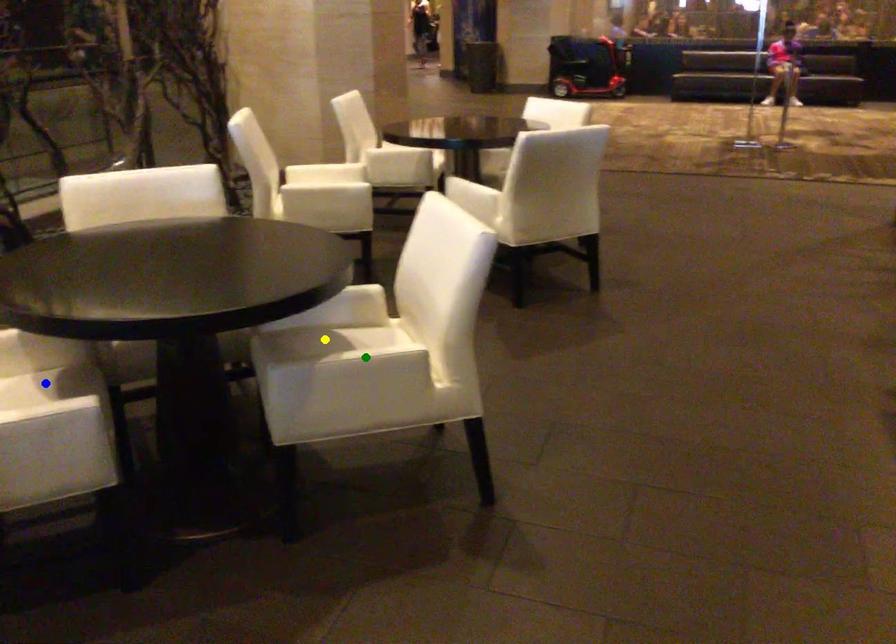
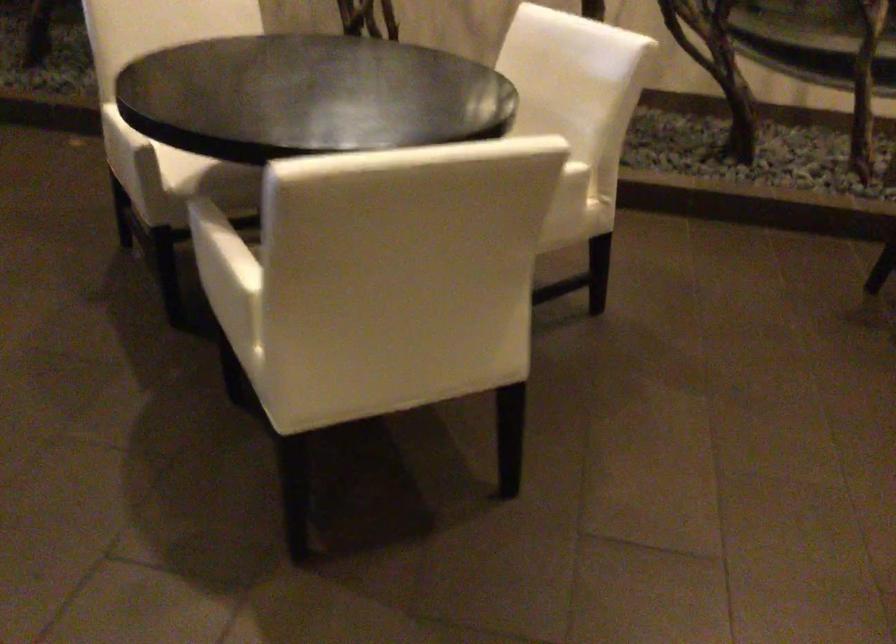
I am providing you with two images of the same scene from different viewpoints. Three points are marked in image1. Which point corresponds to a part or object that is occluded in image2?In image1, three points are marked. Which of them correspond to a part or object that is occluded in image2?Among the three points shown in image1, which one corresponds to a part or object that is no longer visible due to occlusion in image2?

Invisible in image2: yellow point, blue point.